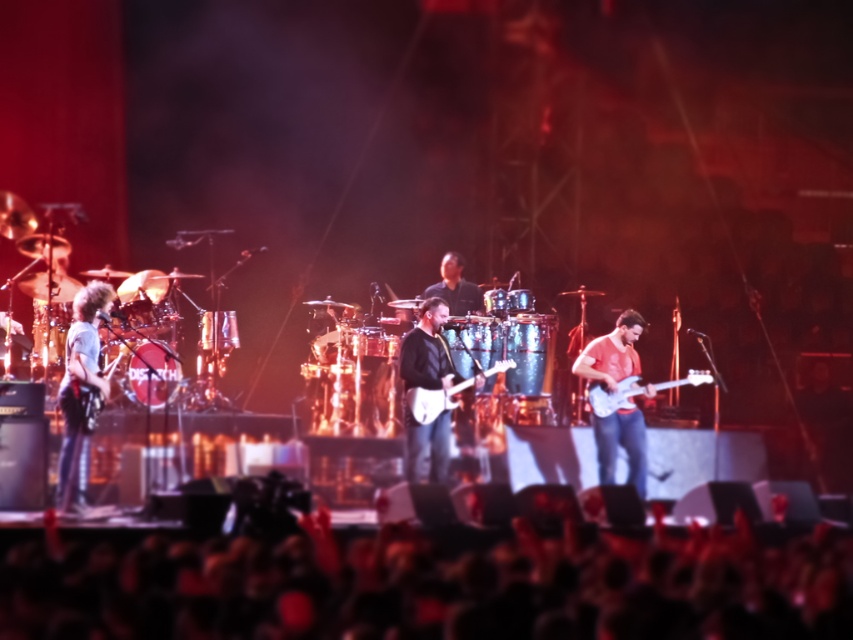
The image size is (853, 640). What do you see at coordinates (430, 582) in the screenshot?
I see `black fabric at lower center` at bounding box center [430, 582].

Does point (340, 604) come farther from viewer compared to point (456, 308)?

No, (340, 604) is in front of (456, 308).

Which is behind, point (194, 568) or point (476, 294)?

Positioned behind is point (476, 294).

I want to click on black fabric at lower center, so click(430, 582).

Is shiny silver guitar at right above black matte guitar at center?

Incorrect, shiny silver guitar at right is not positioned above black matte guitar at center.

How far apart are shiny silver guitar at right and black matte guitar at center?

4.11 feet

Which is in front, point (635, 374) or point (419, 433)?

Point (419, 433) is more forward.

Locate an element on the screen. shiny silver guitar at right is located at coordinates click(612, 353).

Can you confirm if shiny silver guitar at right is positioned below white glossy electric guitar at right?

Yes, shiny silver guitar at right is below white glossy electric guitar at right.

Between point (630, 476) and point (656, 385), which one is positioned in front?

Point (656, 385) is in front.

Where is `shiny silver guitar at right`? shiny silver guitar at right is located at coordinates (612, 353).